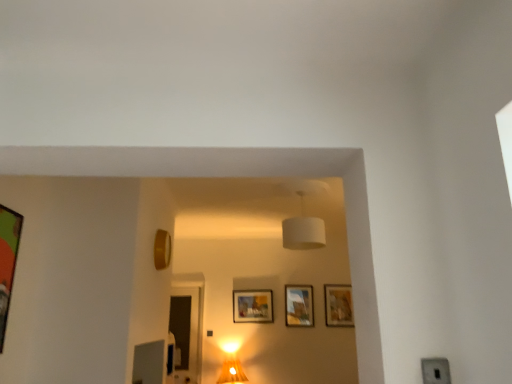
Question: Is matte wooden picture frame at center, which appears as the 3th picture frame when viewed from the back, smaller than matte wooden picture frame at center, which is the 2th picture frame from back to front?

Choices:
 (A) no
 (B) yes

Answer: (A)

Question: From the image's perspective, is matte wooden picture frame at center, positioned as the 3th picture frame in right-to-left order, below matte wooden picture frame at center, which is the second picture frame in right-to-left order?

Choices:
 (A) no
 (B) yes

Answer: (B)

Question: Considering the relative sizes of matte wooden picture frame at center, marked as the 3th picture frame in a front-to-back arrangement, and matte wooden picture frame at center, acting as the 4th picture frame starting from the left, in the image provided, is matte wooden picture frame at center, marked as the 3th picture frame in a front-to-back arrangement, wider than matte wooden picture frame at center, acting as the 4th picture frame starting from the left,?

Choices:
 (A) yes
 (B) no

Answer: (A)

Question: Would you say matte wooden picture frame at center, which is the 2th picture frame from back to front, is part of matte wooden picture frame at center, positioned as the 3th picture frame in right-to-left order,'s contents?

Choices:
 (A) yes
 (B) no

Answer: (B)

Question: Is matte wooden picture frame at center, positioned as the 3th picture frame in right-to-left order, at the left side of matte wooden picture frame at center, which is the second picture frame in right-to-left order?

Choices:
 (A) no
 (B) yes

Answer: (B)

Question: From the image's perspective, is green matte picture frame at left, acting as the first picture frame starting from the left, positioned above or below white fabric lampshade at center?

Choices:
 (A) above
 (B) below

Answer: (B)

Question: Is green matte picture frame at left, arranged as the fifth picture frame when viewed from the back, bigger or smaller than white fabric lampshade at center?

Choices:
 (A) small
 (B) big

Answer: (A)

Question: In terms of height, does green matte picture frame at left, acting as the first picture frame starting from the left, look taller or shorter compared to white fabric lampshade at center?

Choices:
 (A) short
 (B) tall

Answer: (B)

Question: Is point (4, 254) positioned closer to the camera than point (302, 231)?

Choices:
 (A) closer
 (B) farther

Answer: (A)

Question: Is matte wooden picture frame at center, which is the 2th picture frame from back to front, in front of or behind white fabric lampshade at center in the image?

Choices:
 (A) behind
 (B) front

Answer: (A)

Question: Visually, is matte wooden picture frame at center, acting as the 4th picture frame starting from the left, positioned to the left or to the right of white fabric lampshade at center?

Choices:
 (A) right
 (B) left

Answer: (A)

Question: Based on their sizes in the image, would you say matte wooden picture frame at center, marked as the fourth picture frame in a front-to-back arrangement, is bigger or smaller than white fabric lampshade at center?

Choices:
 (A) small
 (B) big

Answer: (A)

Question: In terms of height, does matte wooden picture frame at center, acting as the 4th picture frame starting from the left, look taller or shorter compared to white fabric lampshade at center?

Choices:
 (A) tall
 (B) short

Answer: (B)

Question: Does point (170, 314) appear closer or farther from the camera than point (226, 354)?

Choices:
 (A) farther
 (B) closer

Answer: (A)

Question: Considering the positions of transparent glass door at center and matte gold table lamp at center in the image, is transparent glass door at center wider or thinner than matte gold table lamp at center?

Choices:
 (A) thin
 (B) wide

Answer: (A)